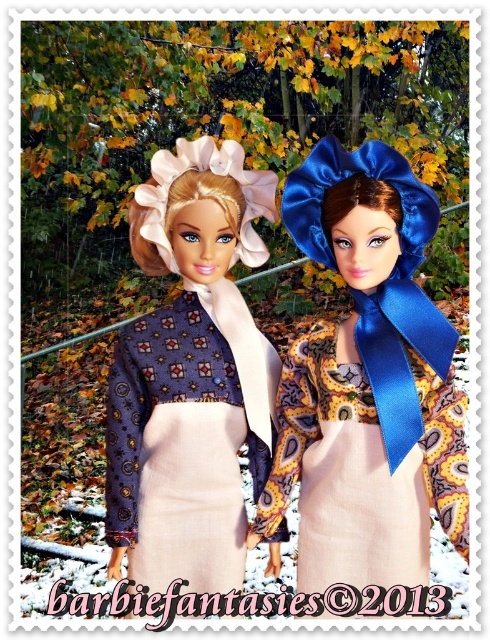
Question: From the image, what is the correct spatial relationship of blue satin bow at upper right in relation to matte blue fabric dress at center?

Choices:
 (A) above
 (B) below

Answer: (A)

Question: Does blue satin bow at upper right appear under matte blue fabric dress at center?

Choices:
 (A) yes
 (B) no

Answer: (B)

Question: Where is blue satin bow at upper right located in relation to matte blue fabric dress at center in the image?

Choices:
 (A) above
 (B) below

Answer: (A)

Question: Which of the following is the closest to the observer?

Choices:
 (A) (143, 580)
 (B) (394, 148)

Answer: (A)